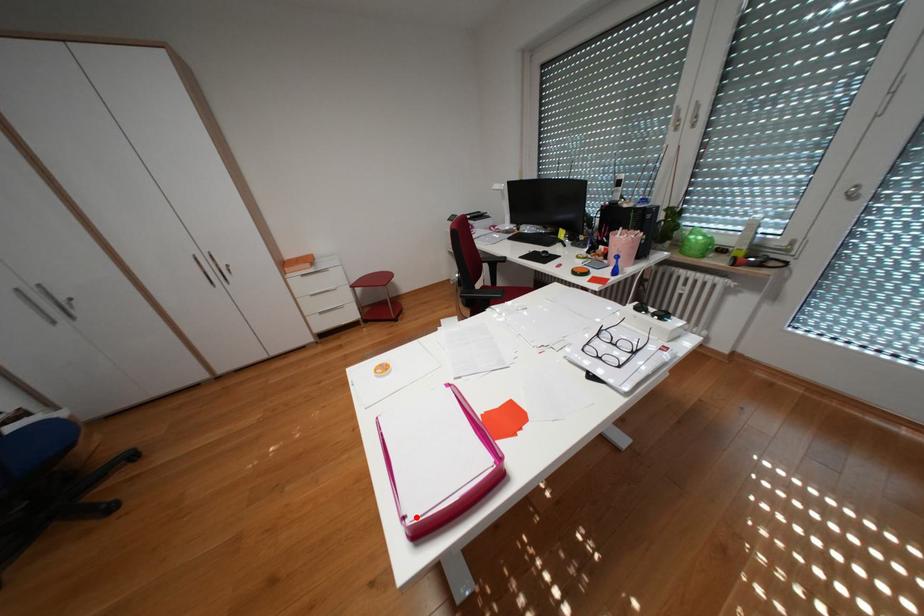
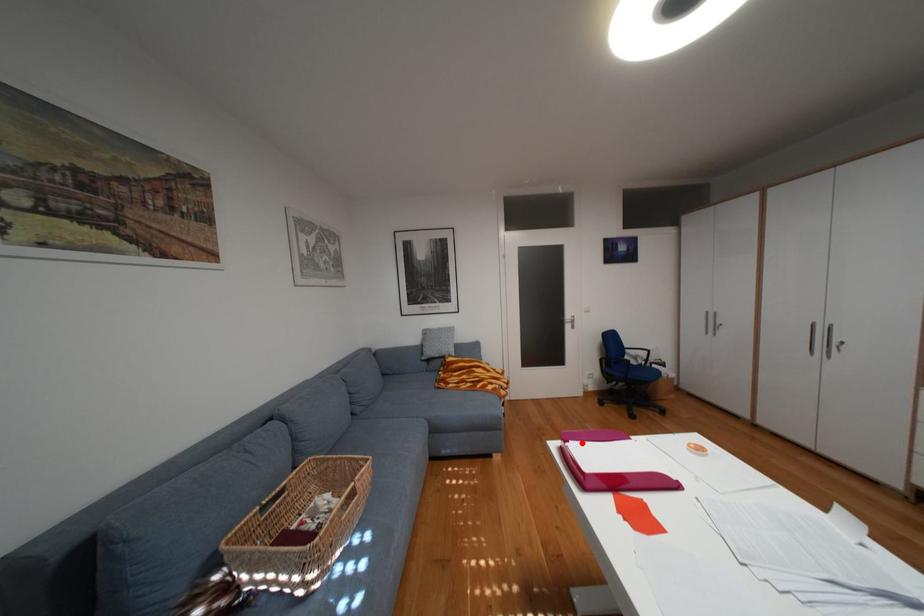
I am providing you with two images of the same scene from different viewpoints. A red point is marked on the first image and another point is marked on the second image. Does the point marked in image1 correspond to the same location as the one in image2?

Yes